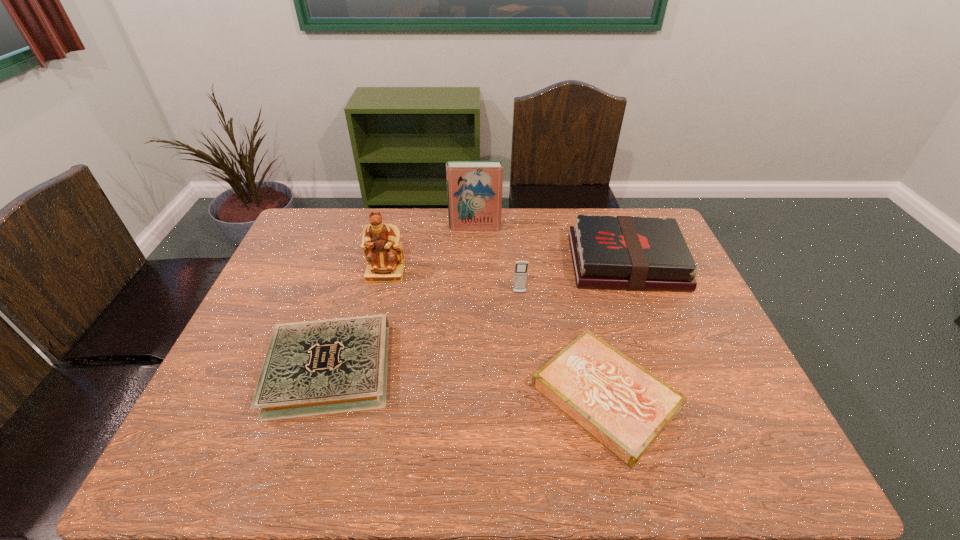
Locate an element on the screen. This screenshot has width=960, height=540. free spot that satisfies the following two spatial constraints: 1. on the cover of the second tallest hardback book; 2. on the right side of the third object from left to right is located at coordinates (474, 263).